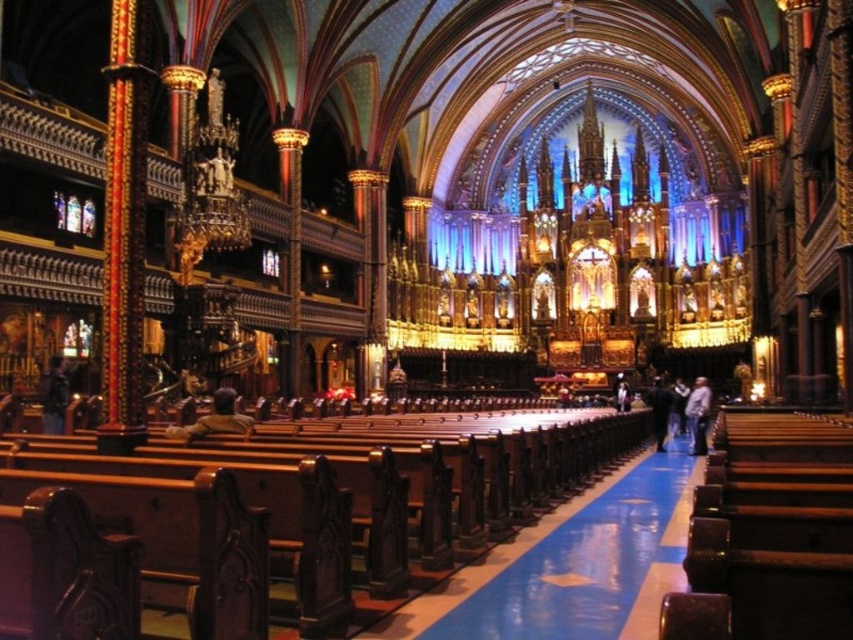
You are standing in the cathedral and notice a dark brown leather jacket at center and a blue glossy aisle at center. Which object is closer to the floor?

The blue glossy aisle at center is located below dark brown leather jacket at center, so it is closer to the floor.

From the picture: You are a visitor entering the cathedral and see the blue glossy aisle at center and the dark brown leather jacket at center. Which object is located to the left of the other?

The blue glossy aisle at center is positioned on the left side of dark brown leather jacket at center.